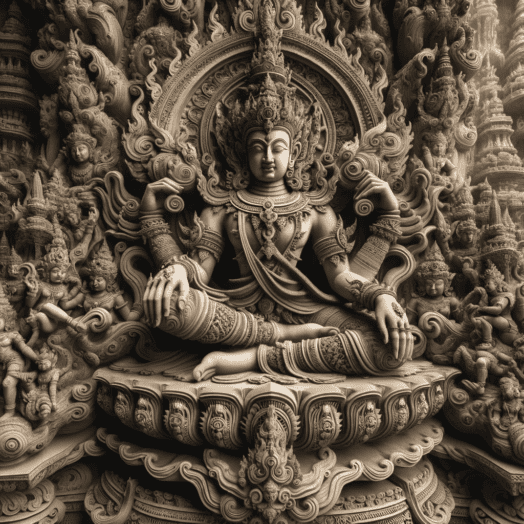
Where is `statuettes`? This screenshot has height=524, width=524. statuettes is located at coordinates (103, 299), (54, 289), (81, 173), (444, 305), (45, 380), (5, 352), (501, 301), (440, 163).